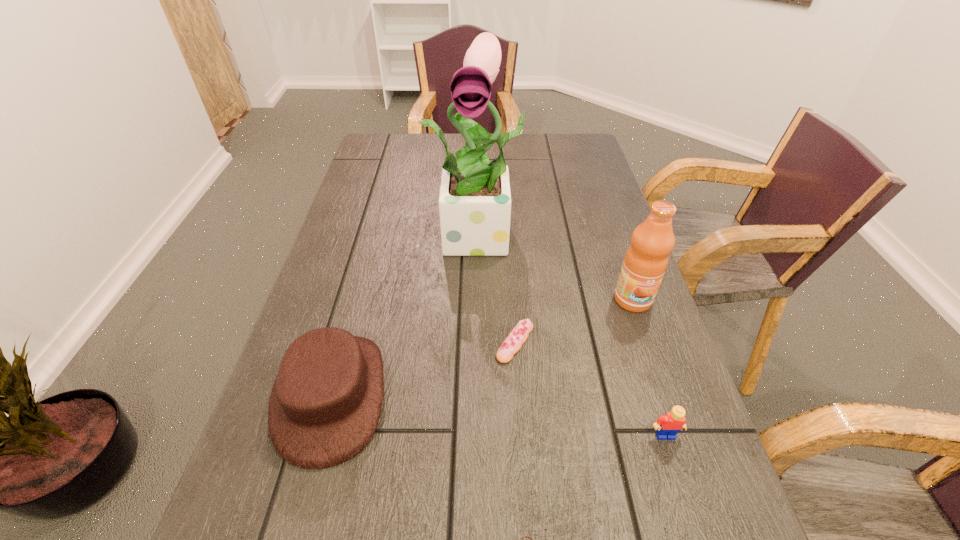
Where is `vacant space in between the flower arrangement and the hat`? The image size is (960, 540). vacant space in between the flower arrangement and the hat is located at coordinates (407, 315).

Where is `free space between the fifth tallest object and the farthest object`? The height and width of the screenshot is (540, 960). free space between the fifth tallest object and the farthest object is located at coordinates (499, 288).

Locate an element on the screen. Image resolution: width=960 pixels, height=540 pixels. vacant space in between the Lego and the fifth tallest object is located at coordinates (590, 388).

Locate an element on the screen. This screenshot has width=960, height=540. vacant space that is in between the leftmost object and the tallest object is located at coordinates [407, 315].

Where is `empty space between the tallest object and the second shortest object`? The width and height of the screenshot is (960, 540). empty space between the tallest object and the second shortest object is located at coordinates (499, 288).

Identify the location of vacant point located between the farthest object and the eclair. Image resolution: width=960 pixels, height=540 pixels. (499, 288).

Find the location of a particular element. The width and height of the screenshot is (960, 540). vacant point located between the fifth tallest object and the Lego is located at coordinates (590, 388).

Find the location of a particular element. The height and width of the screenshot is (540, 960). empty space that is in between the second shortest object and the third shortest object is located at coordinates (590, 388).

Identify which object is the nearest to the tallest object. Please provide its 2D coordinates. Your answer should be formatted as a tuple, i.e. [(x, y)], where the tuple contains the x and y coordinates of a point satisfying the conditions above.

[(645, 262)]

Identify which object is the fifth nearest to the Lego. Please provide its 2D coordinates. Your answer should be formatted as a tuple, i.e. [(x, y)], where the tuple contains the x and y coordinates of a point satisfying the conditions above.

[(325, 404)]